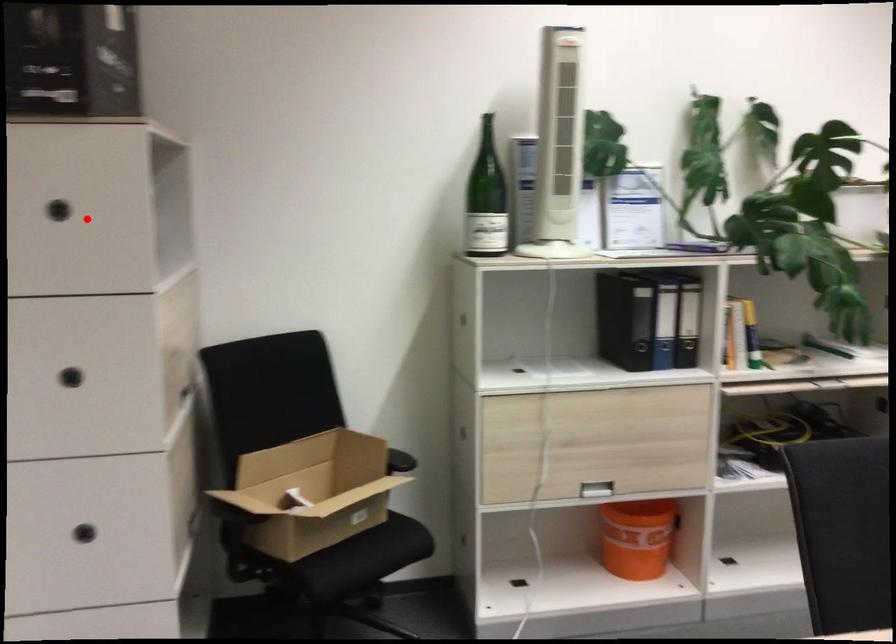
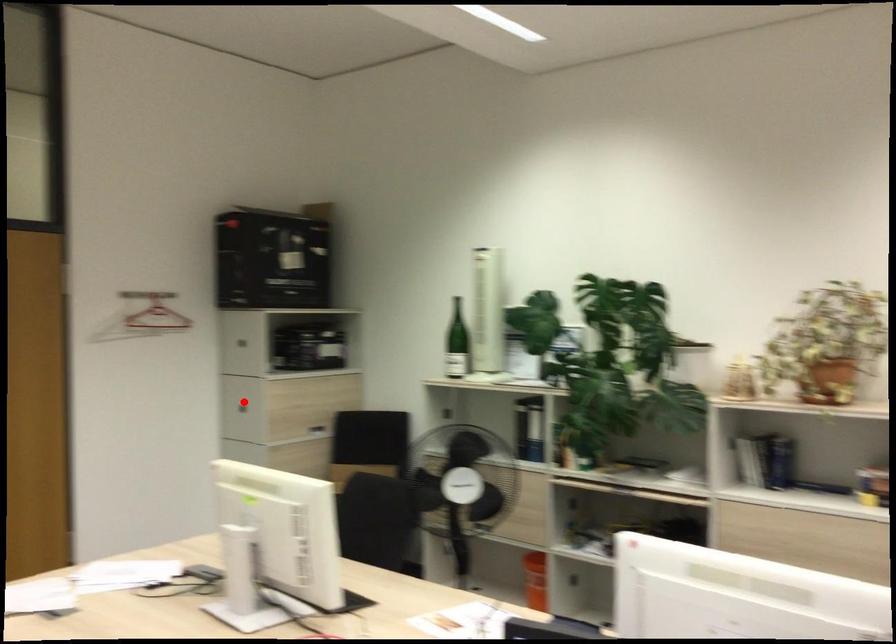
I am providing you with two images of the same scene from different viewpoints. A red point is marked on the first image and another point is marked on the second image. Are the points marked in image1 and image2 representing the same 3D position?

No